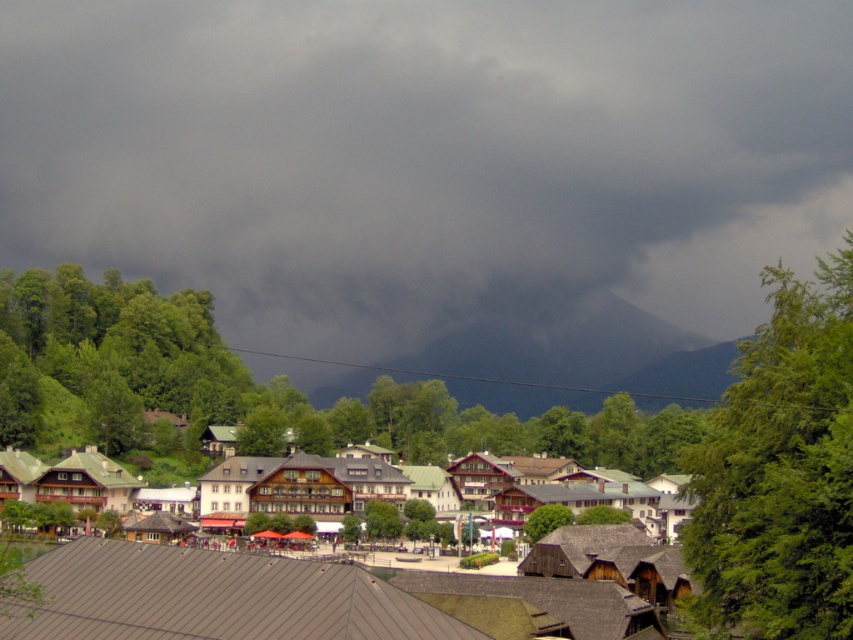
What do you see at coordinates (558, 362) in the screenshot?
I see `dark gray rock at center` at bounding box center [558, 362].

Does dark gray rock at center appear under wooden houses at center?

No, dark gray rock at center is not below wooden houses at center.

Measure the distance between point (593,340) and camera.

The distance of point (593,340) from camera is 421.68 meters.

Locate an element on the screen. dark gray rock at center is located at coordinates (558, 362).

Does dark gray cloud at upper center appear under wooden houses at center?

Actually, dark gray cloud at upper center is above wooden houses at center.

Who is positioned more to the left, dark gray cloud at upper center or wooden houses at center?

dark gray cloud at upper center is more to the left.

Does point (450, 310) come farther from viewer compared to point (640, 467)?

Yes.

Where is `dark gray cloud at upper center`? This screenshot has width=853, height=640. dark gray cloud at upper center is located at coordinates (428, 160).

Does dark gray cloud at upper center have a lesser height compared to dark gray rock at center?

Incorrect, dark gray cloud at upper center's height does not fall short of dark gray rock at center's.

Based on the photo, can you confirm if dark gray cloud at upper center is positioned to the left of dark gray rock at center?

Indeed, dark gray cloud at upper center is positioned on the left side of dark gray rock at center.

The image size is (853, 640). Find the location of `dark gray cloud at upper center`. dark gray cloud at upper center is located at coordinates (428, 160).

The width and height of the screenshot is (853, 640). Identify the location of dark gray cloud at upper center. (428, 160).